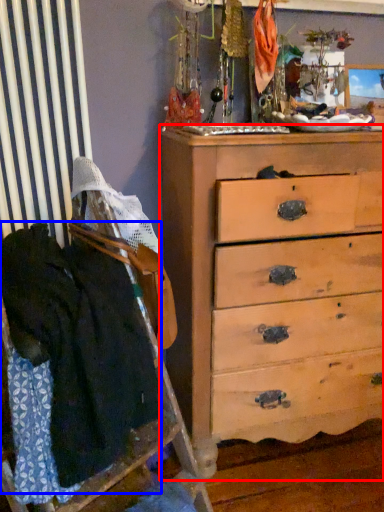
Question: Which point is further to the camera, chest of drawers (highlighted by a red box) or clothing (highlighted by a blue box)?

Choices:
 (A) chest of drawers
 (B) clothing

Answer: (A)